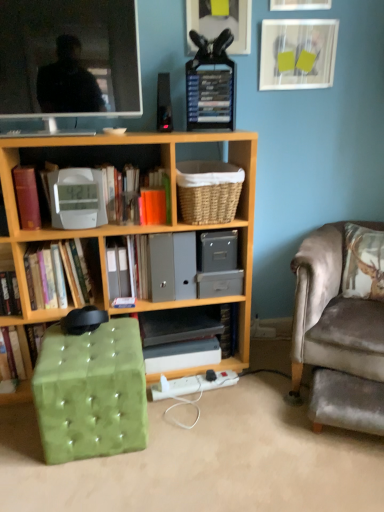
I want to click on empty space that is ontop of velvet green footrest at lower right (from a real-world perspective), so click(356, 381).